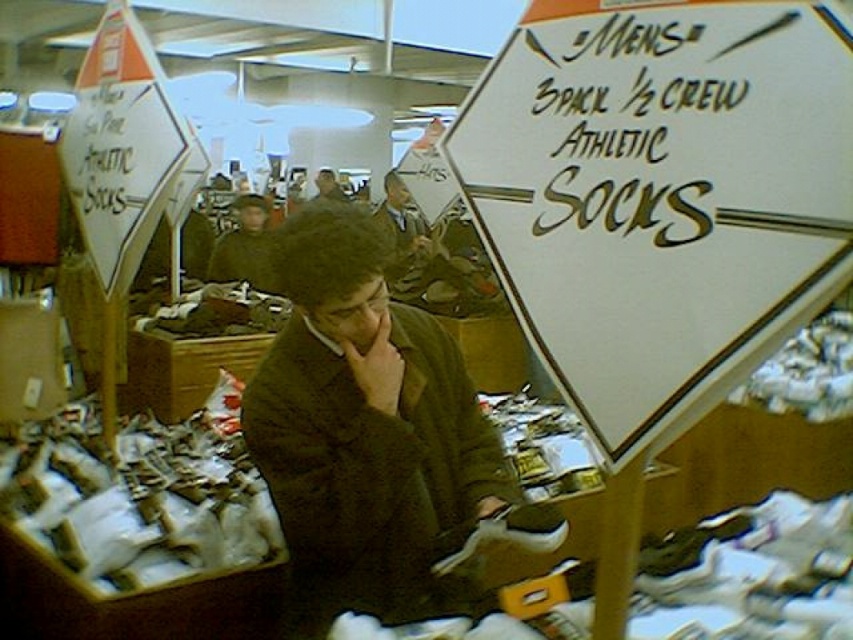
You are a customer in the store and want to read the white paper sign at upper right while standing next to the dark brown jacket at center. Can you see the entire sign without moving your head?

The white paper sign at upper right is shorter than the dark brown jacket at center, so it is possible that the sign is partially obscured by the jacket, making it difficult to see the entire sign without moving your head.

You are a customer standing in the store and want to read the text on the white paper sign at upper right. Is the sign close enough to read comfortably without moving closer?

The white paper sign at upper right is 31.46 inches from the viewer, which is a comfortable distance to read the text without needing to move closer.

You are a customer in the store looking for the socks. You see the white leather shoe at lower center and the dark brown jacket at center. Which object is closer to the sign?

The white leather shoe at lower center is closer to the sign because it is positioned under the dark brown jacket at center, meaning it is lower in the scene and thus nearer to the sign located in the foreground.